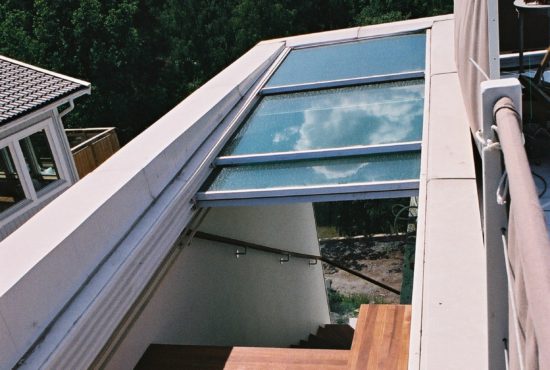
The image size is (550, 370). I want to click on window, so click(x=63, y=162).